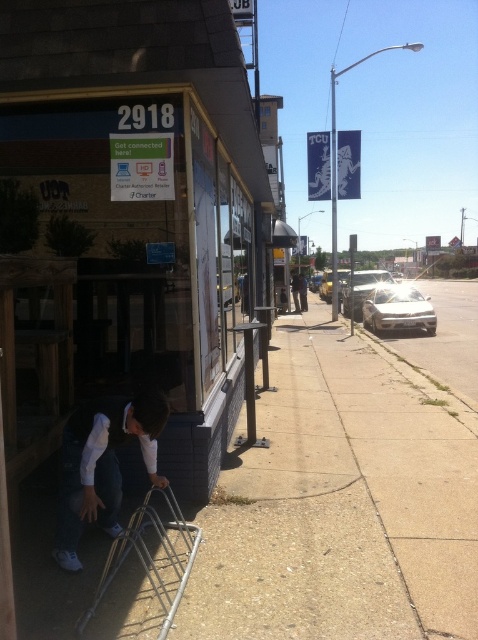
Does white matte squat at lower left lie behind white matte car at right?

That is False.

Can you confirm if white matte squat at lower left is positioned below white matte car at right?

Correct, white matte squat at lower left is located below white matte car at right.

Measure the distance between point (85, 426) and camera.

Point (85, 426) and camera are 3.31 meters apart from each other.

Locate an element on the screen. white matte squat at lower left is located at coordinates [101, 465].